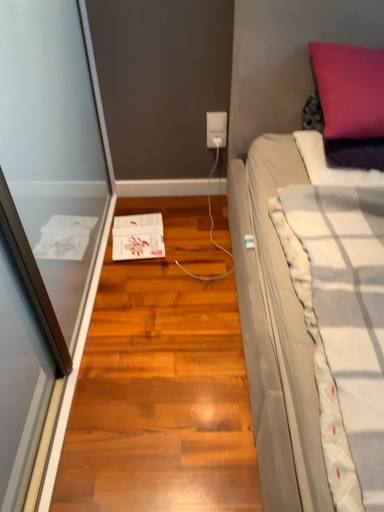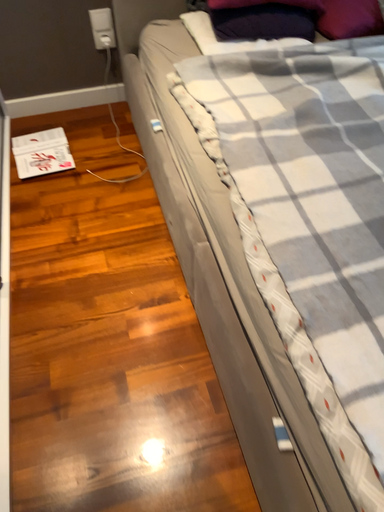
Question: How did the camera likely rotate when shooting the video?

Choices:
 (A) rotated right
 (B) rotated left

Answer: (A)